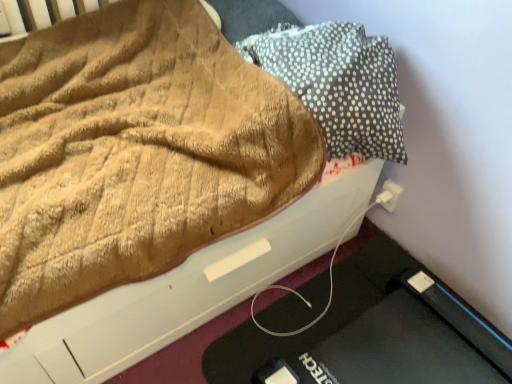
Question: Is white plastic electric outlet at lower right at the back of dark gray dotted pillow at upper right?

Choices:
 (A) no
 (B) yes

Answer: (A)

Question: Does dark gray dotted pillow at upper right turn towards white plastic electric outlet at lower right?

Choices:
 (A) no
 (B) yes

Answer: (A)

Question: Does dark gray dotted pillow at upper right appear on the right side of white plastic electric outlet at lower right?

Choices:
 (A) yes
 (B) no

Answer: (B)

Question: Is dark gray dotted pillow at upper right bigger than white plastic electric outlet at lower right?

Choices:
 (A) no
 (B) yes

Answer: (B)

Question: Is dark gray dotted pillow at upper right thinner than white plastic electric outlet at lower right?

Choices:
 (A) no
 (B) yes

Answer: (A)

Question: Considering the relative sizes of dark gray dotted pillow at upper right and white plastic electric outlet at lower right in the image provided, is dark gray dotted pillow at upper right smaller than white plastic electric outlet at lower right?

Choices:
 (A) no
 (B) yes

Answer: (A)

Question: Could you tell me if white plastic electric outlet at lower right is facing dark gray dotted pillow at upper right?

Choices:
 (A) yes
 (B) no

Answer: (B)

Question: Does white plastic electric outlet at lower right lie in front of dark gray dotted pillow at upper right?

Choices:
 (A) yes
 (B) no

Answer: (B)

Question: From a real-world perspective, is white plastic electric outlet at lower right over dark gray dotted pillow at upper right?

Choices:
 (A) yes
 (B) no

Answer: (B)

Question: Can you confirm if white plastic electric outlet at lower right is smaller than dark gray dotted pillow at upper right?

Choices:
 (A) yes
 (B) no

Answer: (A)

Question: Is white plastic electric outlet at lower right positioned far away from dark gray dotted pillow at upper right?

Choices:
 (A) no
 (B) yes

Answer: (A)

Question: Is white plastic electric outlet at lower right at the right side of dark gray dotted pillow at upper right?

Choices:
 (A) yes
 (B) no

Answer: (A)

Question: Is white plastic electric outlet at lower right in front of or behind dark gray dotted pillow at upper right in the image?

Choices:
 (A) front
 (B) behind

Answer: (B)